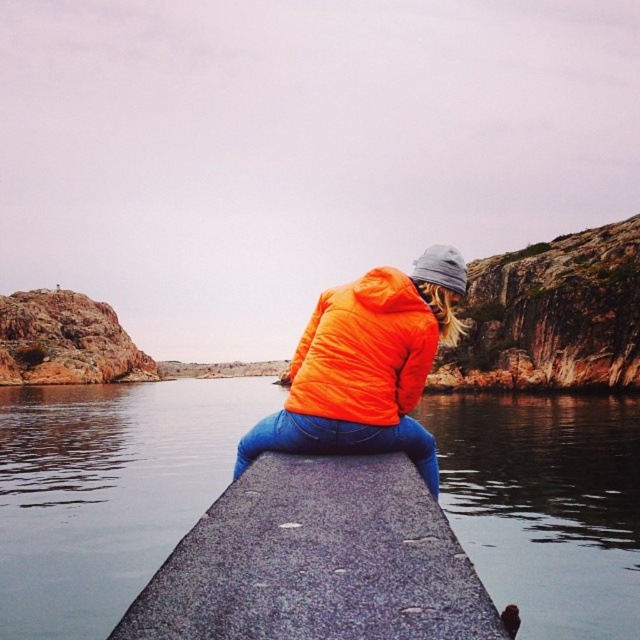
Who is taller, gray speckled concrete at center or orange matte jacket at center?

With more height is orange matte jacket at center.

Based on the photo, is gray speckled concrete at center positioned behind orange matte jacket at center?

No, gray speckled concrete at center is closer to the viewer.

Between point (227, 605) and point (392, 362), which one is positioned behind?

The point (392, 362) is more distant.

The image size is (640, 640). Identify the location of gray speckled concrete at center. click(x=317, y=561).

How distant is smooth dark water at dock center from gray speckled concrete at center?

smooth dark water at dock center is 108.29 feet from gray speckled concrete at center.

Is point (476, 401) positioned behind point (186, 618)?

Yes, it is.

Describe the element at coordinates (106, 492) in the screenshot. I see `smooth dark water at dock center` at that location.

Where is `smooth dark water at dock center`? smooth dark water at dock center is located at coordinates (106, 492).

Who is more distant from viewer, (312, 352) or (342, 288)?

Point (342, 288)

Which is below, orange synthetic jacket at center or orange matte jacket at center?

orange synthetic jacket at center

Is point (380, 284) in front of point (419, 324)?

That is False.

I want to click on orange synthetic jacket at center, so click(365, 365).